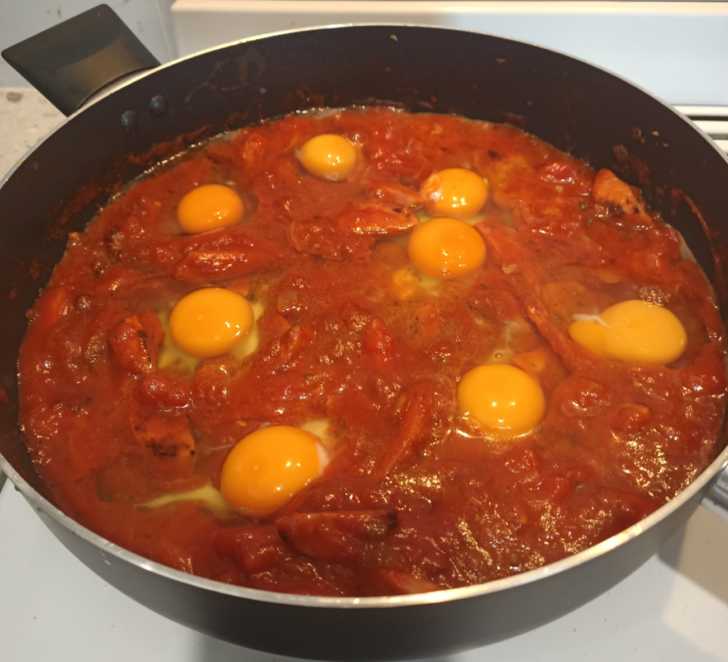
Identify the location of table in front left of cooking pan. (41, 614).